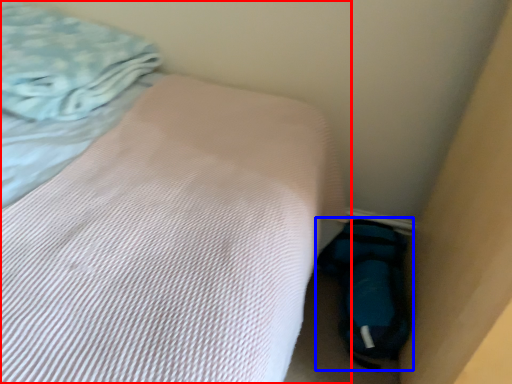
Question: Which object is closer to the camera taking this photo, bed (highlighted by a red box) or sleeping bag (highlighted by a blue box)?

Choices:
 (A) bed
 (B) sleeping bag

Answer: (A)